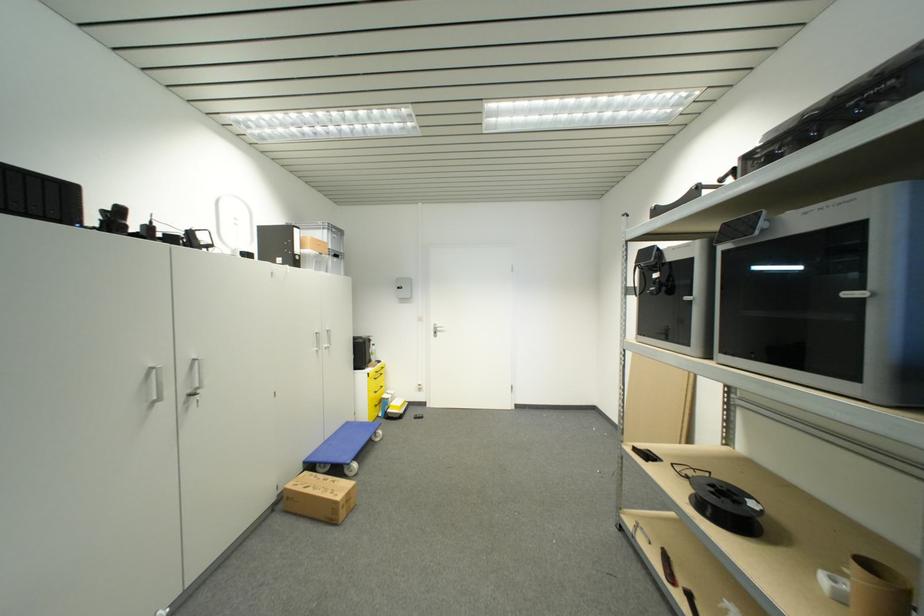
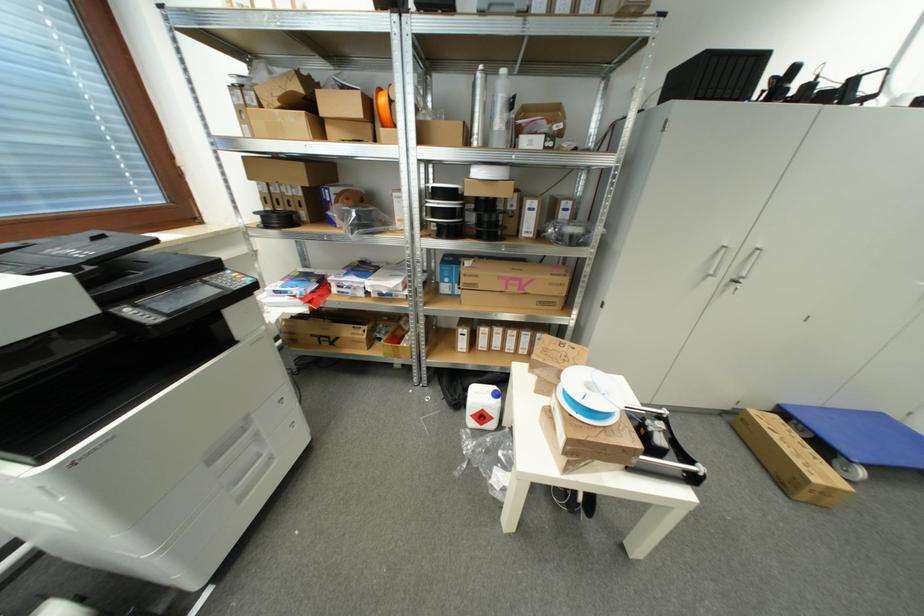
Where in the second image is the point corresponding to [310,476] from the first image?

(781, 419)